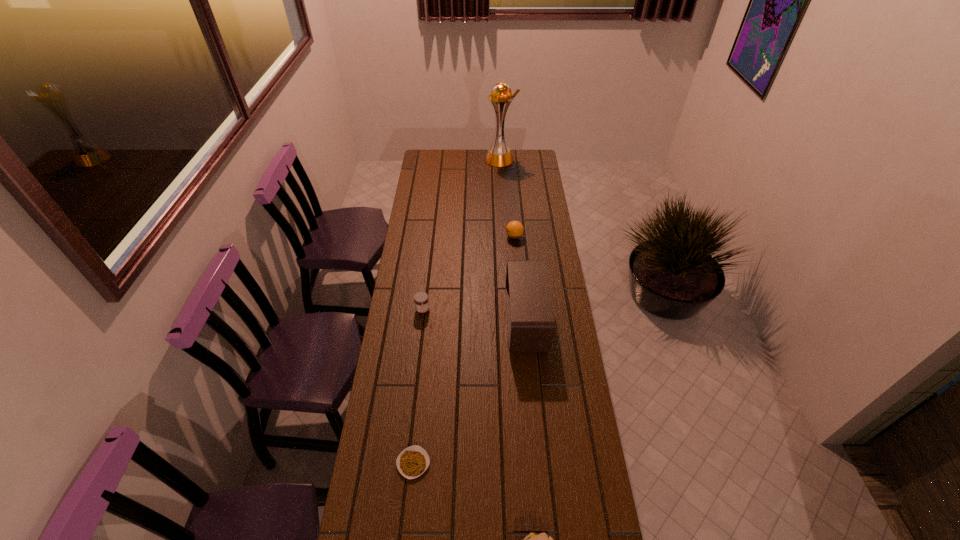
The image size is (960, 540). In order to click on the farthest object in this screenshot , I will do tap(499, 155).

The width and height of the screenshot is (960, 540). In order to click on the tallest object in this screenshot , I will do `click(499, 155)`.

The image size is (960, 540). I want to click on radio receiver, so click(531, 325).

Locate an element on the screen. This screenshot has height=540, width=960. the fifth nearest object is located at coordinates (514, 229).

Identify the location of jam. (421, 300).

The width and height of the screenshot is (960, 540). Identify the location of legume. (412, 462).

Find the location of a particular element. the fifth farthest object is located at coordinates (412, 462).

This screenshot has width=960, height=540. Identify the location of vacant space located 0.110m on the front-facing side of the farthest object. (467, 159).

Identify the location of free space located 0.170m on the front-facing side of the farthest object. This screenshot has width=960, height=540. (456, 159).

The width and height of the screenshot is (960, 540). What are the coordinates of `vacant area situated 0.060m on the front-facing side of the farthest object` in the screenshot? It's located at (474, 159).